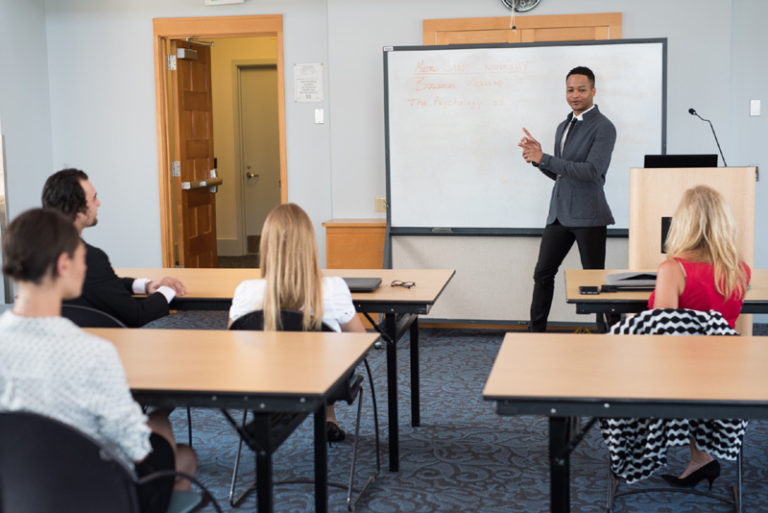
At what (x,y) coordinates should I click in order to perform the action: click on chair legs. Please return your answer as a coordinate pair (x, y). Looking at the image, I should click on (356, 473), (234, 470), (742, 492), (614, 492), (378, 459), (190, 425), (214, 500).